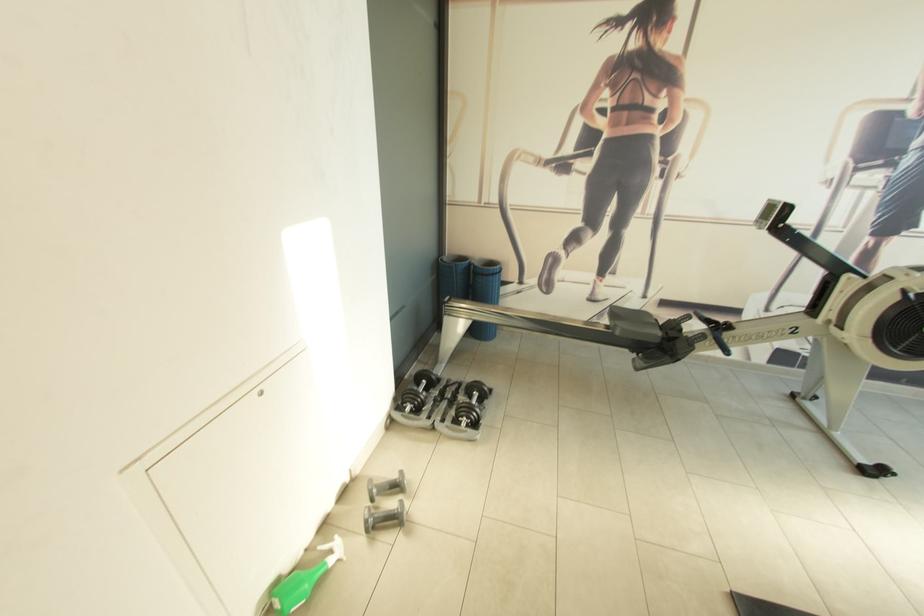
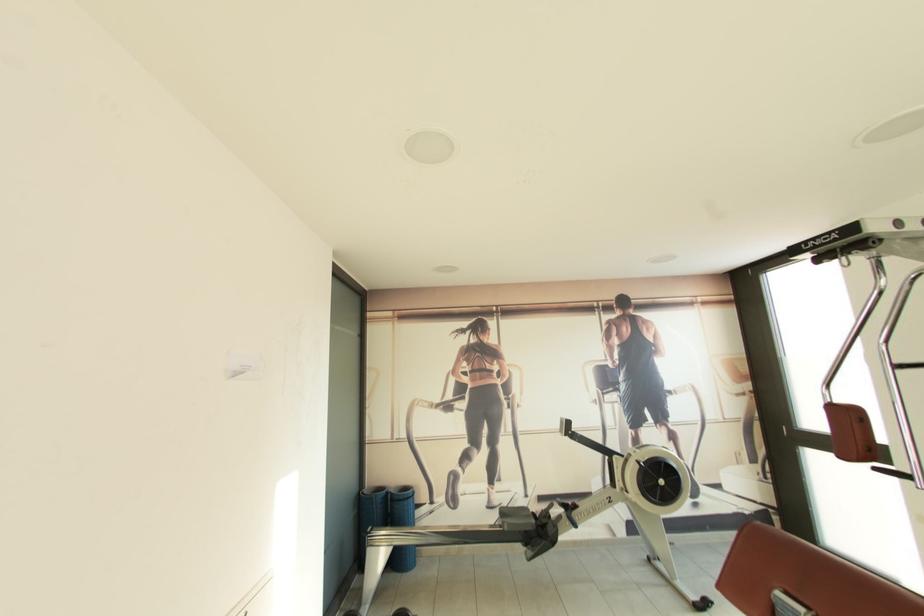
The point at (451, 261) is marked in the first image. Where is the corresponding point in the second image?

(371, 493)